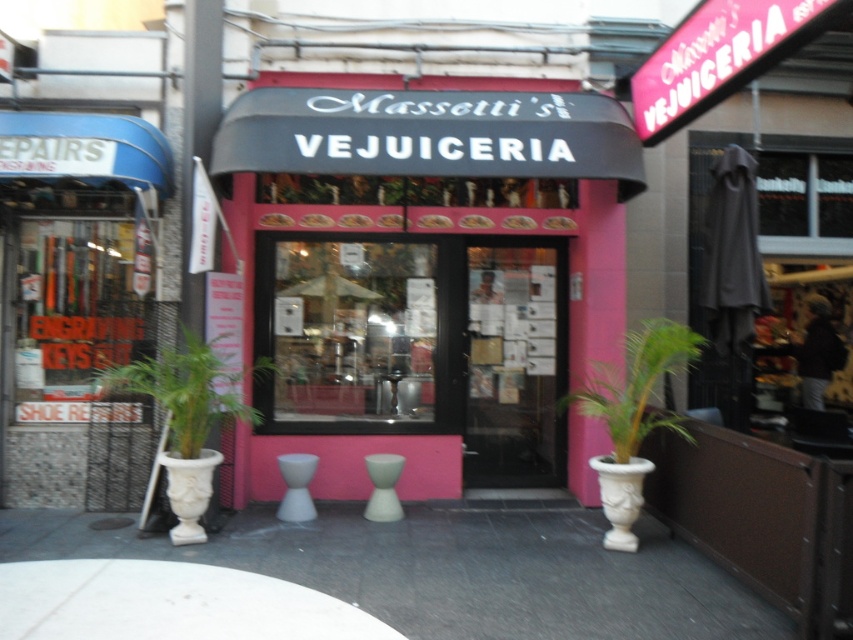
Question: Which of the following is the farthest from the observer?

Choices:
 (A) green leafy plant at lower left
 (B) white glossy stool at center
 (C) transparent glass door at center

Answer: (C)

Question: Can you confirm if transparent glass door at center is positioned to the left of green leafy plant at lower right?

Choices:
 (A) yes
 (B) no

Answer: (A)

Question: Among these points, which one is farthest from the camera?

Choices:
 (A) tap(212, 355)
 (B) tap(305, 460)

Answer: (B)

Question: Which is farther from the green leafy plant at lower left?

Choices:
 (A) white glossy stool at center
 (B) white matte stool at center
 (C) transparent glass door at center

Answer: (C)

Question: Does green leafy plant at lower left have a greater width compared to white matte stool at center?

Choices:
 (A) yes
 (B) no

Answer: (A)

Question: Is green leafy plant at lower right to the right of green leafy plant at lower left from the viewer's perspective?

Choices:
 (A) no
 (B) yes

Answer: (B)